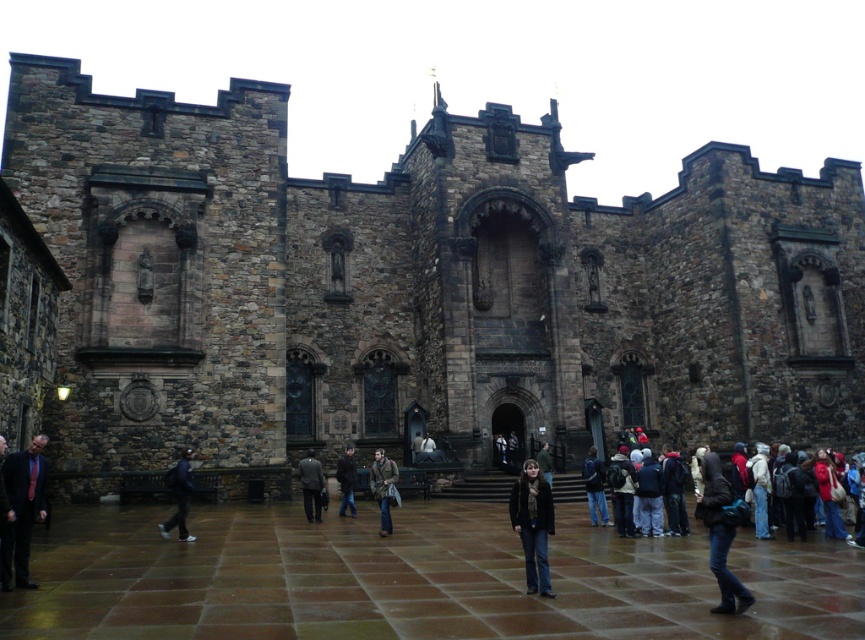
You are standing in the courtyard of the historic stone building. There is a point marked at coordinates point (344, 509). If you want to take a photo of this point from where you are standing, will the camera need to zoom in or out to capture the entire point in the frame?

The point (344, 509) is 178.61 feet away from the camera. Since the point is a single location, zooming out slightly may be necessary to ensure it is fully visible within the frame, depending on the camera lens and field of view.

You are standing in the courtyard of a medieval castle after a rainstorm. You see a dark gray wool coat at center and a dark brown leather jacket at center. Which clothing item is bigger?

The dark gray wool coat at center is larger in size than the dark brown leather jacket at center.

You are a medieval knight standing in the courtyard of the castle. You see a dark gray wool coat at center and a dark brown leather jacket at center. Which clothing item takes up more horizontal space?

The dark gray wool coat at center might be wider than dark brown leather jacket at center, so it likely takes up more horizontal space.